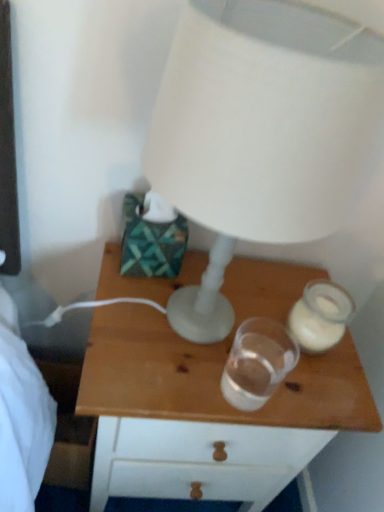
Describe the element at coordinates (257, 362) in the screenshot. I see `transparent glass at center, the first candle holder positioned from the left` at that location.

You are a GUI agent. You are given a task and a screenshot of the screen. Output one action in this format:
    pyautogui.click(x=<x>, y=<y>)
    Task: Click on the wooden nightstand at center
    
    Given the screenshot: What is the action you would take?
    pyautogui.click(x=211, y=399)

In the image, is transparent glass at center, positioned as the second candle holder in right-to-left order, on the left side or the right side of translucent glass candle holder at right, the first candle holder in the right-to-left sequence?

In the image, transparent glass at center, positioned as the second candle holder in right-to-left order, appears on the left side of translucent glass candle holder at right, the first candle holder in the right-to-left sequence.

In terms of width, does transparent glass at center, positioned as the second candle holder in right-to-left order, look wider or thinner when compared to translucent glass candle holder at right, the second candle holder viewed from the left?

In the image, transparent glass at center, positioned as the second candle holder in right-to-left order, appears to be more narrow than translucent glass candle holder at right, the second candle holder viewed from the left.

From a real-world perspective, which object stands above the other?

transparent glass at center, the first candle holder positioned from the left, from a real-world perspective.

Is white matte lamp at upper center surrounded by translucent glass candle holder at right, the first candle holder in the right-to-left sequence?

No.

Considering the relative sizes of translucent glass candle holder at right, the second candle holder viewed from the left, and white matte lamp at upper center in the image provided, is translucent glass candle holder at right, the second candle holder viewed from the left, wider than white matte lamp at upper center?

No, translucent glass candle holder at right, the second candle holder viewed from the left, is not wider than white matte lamp at upper center.

From the image's perspective, which object appears higher, translucent glass candle holder at right, the first candle holder in the right-to-left sequence, or white matte lamp at upper center?

white matte lamp at upper center appears higher in the image.

Looking at this image, is translucent glass candle holder at right, the second candle holder viewed from the left, facing towards white matte lamp at upper center?

No, translucent glass candle holder at right, the second candle holder viewed from the left, is not facing towards white matte lamp at upper center.

From a real-world perspective, relative to translucent glass candle holder at right, the first candle holder in the right-to-left sequence, is wooden nightstand at center vertically above or below?

From a real-world perspective, wooden nightstand at center is physically below translucent glass candle holder at right, the first candle holder in the right-to-left sequence.

How many degrees apart are the facing directions of wooden nightstand at center and translucent glass candle holder at right, the second candle holder viewed from the left?

The facing directions of wooden nightstand at center and translucent glass candle holder at right, the second candle holder viewed from the left, are 1.93 degrees apart.

Which is behind, point (167, 455) or point (311, 326)?

The point (167, 455) is farther from the camera.

Are wooden nightstand at center and translucent glass candle holder at right, the first candle holder in the right-to-left sequence, making contact?

wooden nightstand at center and translucent glass candle holder at right, the first candle holder in the right-to-left sequence, are not in contact.

In terms of height, does translucent glass candle holder at right, the first candle holder in the right-to-left sequence, look taller or shorter compared to wooden nightstand at center?

Clearly, translucent glass candle holder at right, the first candle holder in the right-to-left sequence, is shorter compared to wooden nightstand at center.

From a real-world perspective, does translucent glass candle holder at right, the second candle holder viewed from the left, stand above wooden nightstand at center?

Yes.

Is translucent glass candle holder at right, the second candle holder viewed from the left, completely or partially outside of wooden nightstand at center?

Indeed, translucent glass candle holder at right, the second candle holder viewed from the left, is completely outside wooden nightstand at center.

From the image's perspective, is translucent glass candle holder at right, the second candle holder viewed from the left, positioned above or below wooden nightstand at center?

translucent glass candle holder at right, the second candle holder viewed from the left, is situated higher than wooden nightstand at center in the image.

Does translucent glass candle holder at right, the first candle holder in the right-to-left sequence, have a lesser width compared to transparent glass at center, positioned as the second candle holder in right-to-left order?

No.

Who is taller, translucent glass candle holder at right, the second candle holder viewed from the left, or transparent glass at center, positioned as the second candle holder in right-to-left order?

With more height is transparent glass at center, positioned as the second candle holder in right-to-left order.

From the image's perspective, is translucent glass candle holder at right, the first candle holder in the right-to-left sequence, positioned above or below transparent glass at center, the first candle holder positioned from the left?

Based on their image positions, translucent glass candle holder at right, the first candle holder in the right-to-left sequence, is located above transparent glass at center, the first candle holder positioned from the left.

Between wooden nightstand at center and transparent glass at center, positioned as the second candle holder in right-to-left order, which one has smaller size?

Smaller between the two is transparent glass at center, positioned as the second candle holder in right-to-left order.

Which object is wider, wooden nightstand at center or transparent glass at center, positioned as the second candle holder in right-to-left order?

Wider between the two is wooden nightstand at center.

Does wooden nightstand at center turn towards transparent glass at center, the first candle holder positioned from the left?

No, wooden nightstand at center does not turn towards transparent glass at center, the first candle holder positioned from the left.

Is there a large distance between wooden nightstand at center and white matte lamp at upper center?

Actually, wooden nightstand at center and white matte lamp at upper center are a little close together.

Where is `nightstand located behind the white matte lamp at upper center`? The height and width of the screenshot is (512, 384). nightstand located behind the white matte lamp at upper center is located at coordinates (211, 399).

Which is nearer, (137, 311) or (291, 71)?

The point (291, 71) is closer to the camera.

How different are the orientations of wooden nightstand at center and white matte lamp at upper center in degrees?

The angular difference between wooden nightstand at center and white matte lamp at upper center is 1.43 degrees.

This screenshot has height=512, width=384. I want to click on candle holder in front of the translucent glass candle holder at right, the first candle holder in the right-to-left sequence, so pyautogui.click(x=257, y=362).

The image size is (384, 512). In order to click on the 2nd candle holder directly beneath the white matte lamp at upper center (from a real-world perspective) in this screenshot , I will do `click(320, 316)`.

When comparing their distances from white matte lamp at upper center, does transparent glass at center, the first candle holder positioned from the left, or translucent glass candle holder at right, the first candle holder in the right-to-left sequence, seem closer?

transparent glass at center, the first candle holder positioned from the left, is positioned closer to the anchor white matte lamp at upper center.

From the picture: When comparing their distances from transparent glass at center, positioned as the second candle holder in right-to-left order, does translucent glass candle holder at right, the first candle holder in the right-to-left sequence, or wooden nightstand at center seem closer?

translucent glass candle holder at right, the first candle holder in the right-to-left sequence, is positioned closer to the anchor transparent glass at center, positioned as the second candle holder in right-to-left order.

Considering their positions, is wooden nightstand at center positioned closer to translucent glass candle holder at right, the first candle holder in the right-to-left sequence, than transparent glass at center, the first candle holder positioned from the left?

transparent glass at center, the first candle holder positioned from the left, is closer to translucent glass candle holder at right, the first candle holder in the right-to-left sequence.

Considering their positions, is wooden nightstand at center positioned closer to transparent glass at center, the first candle holder positioned from the left, than translucent glass candle holder at right, the first candle holder in the right-to-left sequence?

Based on the image, translucent glass candle holder at right, the first candle holder in the right-to-left sequence, appears to be nearer to transparent glass at center, the first candle holder positioned from the left.

When comparing their distances from translucent glass candle holder at right, the first candle holder in the right-to-left sequence, does transparent glass at center, the first candle holder positioned from the left, or white matte lamp at upper center seem further?

white matte lamp at upper center is positioned further to the anchor translucent glass candle holder at right, the first candle holder in the right-to-left sequence.

Looking at the image, which one is located further to translucent glass candle holder at right, the first candle holder in the right-to-left sequence, wooden nightstand at center or white matte lamp at upper center?

The object further to translucent glass candle holder at right, the first candle holder in the right-to-left sequence, is white matte lamp at upper center.

Estimate the real-world distances between objects in this image. Which object is closer to wooden nightstand at center, transparent glass at center, positioned as the second candle holder in right-to-left order, or translucent glass candle holder at right, the second candle holder viewed from the left?

transparent glass at center, positioned as the second candle holder in right-to-left order, is closer to wooden nightstand at center.

Looking at the image, which one is located closer to transparent glass at center, the first candle holder positioned from the left, wooden nightstand at center or white matte lamp at upper center?

The object closer to transparent glass at center, the first candle holder positioned from the left, is wooden nightstand at center.

The image size is (384, 512). I want to click on candle holder between translucent glass candle holder at right, the second candle holder viewed from the left, and wooden nightstand at center from top to bottom, so click(257, 362).

This screenshot has height=512, width=384. I want to click on candle holder between white matte lamp at upper center and translucent glass candle holder at right, the second candle holder viewed from the left, in the front-back direction, so pos(257,362).